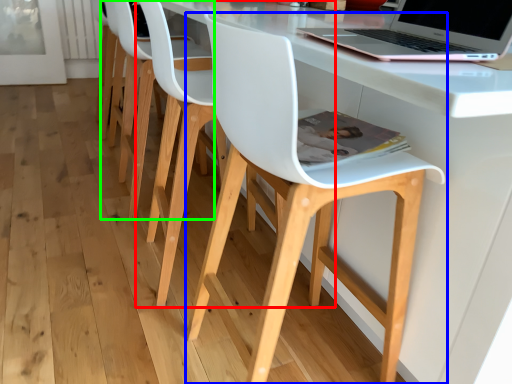
Question: Based on their relative distances, which object is farther from chair (highlighted by a red box)? Choose from chair (highlighted by a blue box) and chair (highlighted by a green box).

Choices:
 (A) chair
 (B) chair

Answer: (A)